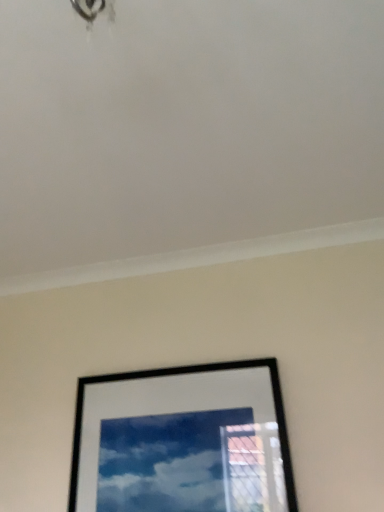
What do you see at coordinates (183, 441) in the screenshot? The image size is (384, 512). I see `black matte picture frame at lower center` at bounding box center [183, 441].

You are a GUI agent. You are given a task and a screenshot of the screen. Output one action in this format:
    pyautogui.click(x=<x>, y=<y>)
    Task: Click on the black matte picture frame at lower center
    This screenshot has height=512, width=384.
    Given the screenshot: What is the action you would take?
    pyautogui.click(x=183, y=441)

Locate an element on the screen. This screenshot has width=384, height=512. black matte picture frame at lower center is located at coordinates (183, 441).